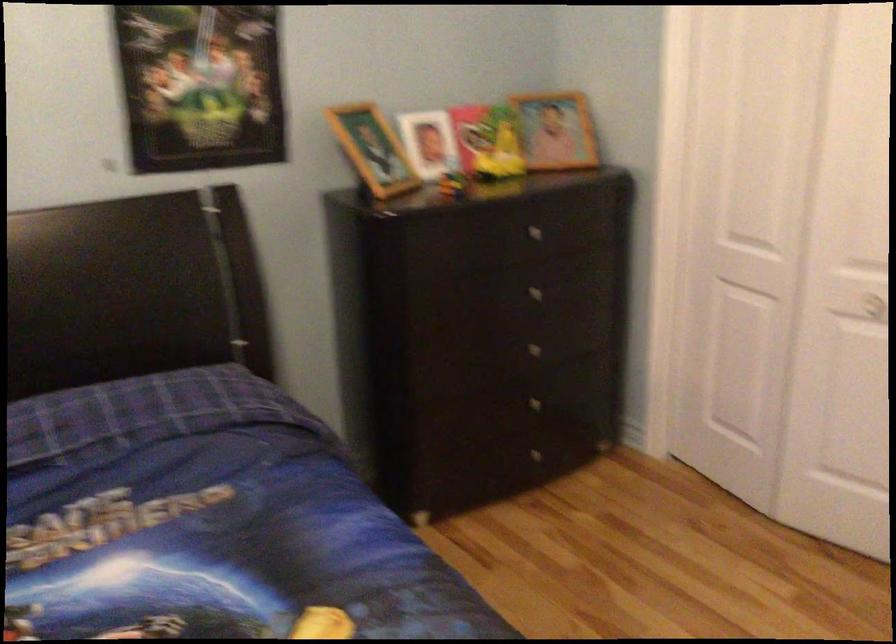
Where would you turn the white door knob? Please return your answer as a coordinate pair (x, y).

(864, 305)